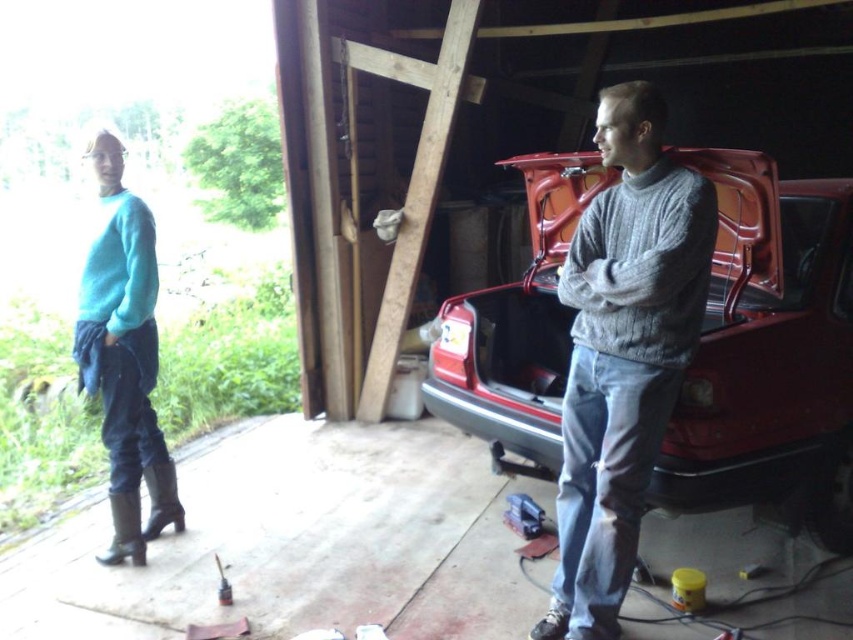
You are organizing a clothing donation drive and need to sort items by size. You have a gray knitted sweater at center and a teal sweater at left. Which sweater should you place in the large size bin?

The gray knitted sweater at center should be placed in the large size bin because it is bigger than the teal sweater at left.

You are standing inside the rustic garage and want to move from one point to another. There are two points marked in the scene. Which point, point (595, 509) or point (146, 348), is closer to you?

Point (595, 509) is closer to you than point (146, 348).

You are standing inside the rustic garage and looking at two points marked in the scene. Which point, point (x=781, y=234) or point (x=578, y=348), is closer to you?

Point (x=781, y=234) is further to the viewer than point (x=578, y=348), so the closer point is point (x=578, y=348).